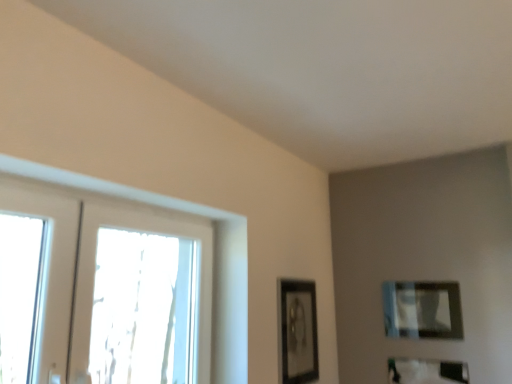
How much space does matte black picture frame at center, acting as the 3th picture frame starting from the right, occupy vertically?

matte black picture frame at center, acting as the 3th picture frame starting from the right, is 20.50 inches in height.

This screenshot has width=512, height=384. Describe the element at coordinates (103, 289) in the screenshot. I see `clear glass window at left` at that location.

Locate an element on the screen. The height and width of the screenshot is (384, 512). matte black picture frame at center, marked as the first picture frame in a left-to-right arrangement is located at coordinates (298, 331).

Does matte black picture frame at lower right, marked as the 1th picture frame in a right-to-left arrangement, touch matte black picture frame at center, acting as the 3th picture frame starting from the right?

No.

Considering the relative sizes of matte black picture frame at lower right, the 3th picture frame viewed from the left, and matte black picture frame at center, marked as the first picture frame in a left-to-right arrangement, in the image provided, is matte black picture frame at lower right, the 3th picture frame viewed from the left, wider than matte black picture frame at center, marked as the first picture frame in a left-to-right arrangement,?

Correct, the width of matte black picture frame at lower right, the 3th picture frame viewed from the left, exceeds that of matte black picture frame at center, marked as the first picture frame in a left-to-right arrangement.

In the scene shown: Could you tell me if matte black picture frame at lower right, the 3th picture frame viewed from the left, is facing matte black picture frame at center, marked as the first picture frame in a left-to-right arrangement?

No.

Between point (304, 326) and point (456, 311), which one is positioned behind?

Point (456, 311)

Is matte black picture frame at center, acting as the 3th picture frame starting from the right, in front of matte black picture frame at upper right, which is counted as the 2th picture frame, starting from the right?

Yes.

Which of these two, matte black picture frame at center, marked as the first picture frame in a left-to-right arrangement, or matte black picture frame at upper right, which is counted as the 2th picture frame, starting from the left, is smaller?

matte black picture frame at upper right, which is counted as the 2th picture frame, starting from the left.

From the matte black picture frame at center, marked as the first picture frame in a left-to-right arrangement, count 1st picture frame to the right and point to it. Please provide its 2D coordinates.

[(422, 309)]

Which is closer to the camera, (129,208) or (407,282)?

Point (129,208)

Is clear glass window at left to the left or to the right of matte black picture frame at upper right, which is counted as the 2th picture frame, starting from the left, in the image?

In the image, clear glass window at left appears on the left side of matte black picture frame at upper right, which is counted as the 2th picture frame, starting from the left.

Can you confirm if clear glass window at left is shorter than matte black picture frame at upper right, which is counted as the 2th picture frame, starting from the left?

No, clear glass window at left is not shorter than matte black picture frame at upper right, which is counted as the 2th picture frame, starting from the left.

Based on the photo, could you tell me if clear glass window at left is turned towards matte black picture frame at upper right, which is counted as the 2th picture frame, starting from the right?

No, clear glass window at left is not facing towards matte black picture frame at upper right, which is counted as the 2th picture frame, starting from the right.

Is matte black picture frame at upper right, which is counted as the 2th picture frame, starting from the right, looking in the opposite direction of matte black picture frame at center, marked as the first picture frame in a left-to-right arrangement?

No, matte black picture frame at upper right, which is counted as the 2th picture frame, starting from the right,'s orientation is not away from matte black picture frame at center, marked as the first picture frame in a left-to-right arrangement.

Is matte black picture frame at upper right, which is counted as the 2th picture frame, starting from the right, outside of matte black picture frame at center, marked as the first picture frame in a left-to-right arrangement?

matte black picture frame at upper right, which is counted as the 2th picture frame, starting from the right, is positioned outside matte black picture frame at center, marked as the first picture frame in a left-to-right arrangement.

From a real-world perspective, is matte black picture frame at upper right, which is counted as the 2th picture frame, starting from the left, positioned under matte black picture frame at center, acting as the 3th picture frame starting from the right, based on gravity?

Incorrect, from a real-world perspective, matte black picture frame at upper right, which is counted as the 2th picture frame, starting from the left, is higher than matte black picture frame at center, acting as the 3th picture frame starting from the right.

Visually, is matte black picture frame at upper right, which is counted as the 2th picture frame, starting from the left, positioned to the left or to the right of matte black picture frame at center, acting as the 3th picture frame starting from the right?

matte black picture frame at upper right, which is counted as the 2th picture frame, starting from the left, is to the right of matte black picture frame at center, acting as the 3th picture frame starting from the right.

Is matte black picture frame at lower right, the 3th picture frame viewed from the left, in contact with clear glass window at left?

No, matte black picture frame at lower right, the 3th picture frame viewed from the left, is not touching clear glass window at left.

Locate an element on the screen. This screenshot has height=384, width=512. window on the left of matte black picture frame at lower right, marked as the 1th picture frame in a right-to-left arrangement is located at coordinates (103, 289).

From a real-world perspective, is matte black picture frame at lower right, marked as the 1th picture frame in a right-to-left arrangement, under clear glass window at left?

Yes, from a real-world perspective, matte black picture frame at lower right, marked as the 1th picture frame in a right-to-left arrangement, is below clear glass window at left.

Does matte black picture frame at lower right, marked as the 1th picture frame in a right-to-left arrangement, have a greater height compared to clear glass window at left?

Incorrect, the height of matte black picture frame at lower right, marked as the 1th picture frame in a right-to-left arrangement, is not larger of that of clear glass window at left.

Can you tell me how much clear glass window at left and matte black picture frame at lower right, marked as the 1th picture frame in a right-to-left arrangement, differ in facing direction?

The angular difference between clear glass window at left and matte black picture frame at lower right, marked as the 1th picture frame in a right-to-left arrangement, is 90.1 degrees.

Locate an element on the screen. This screenshot has width=512, height=384. the 3rd picture frame below the clear glass window at left (from the image's perspective) is located at coordinates (426, 371).

From the image's perspective, is clear glass window at left over matte black picture frame at lower right, the 3th picture frame viewed from the left?

Correct, clear glass window at left appears higher than matte black picture frame at lower right, the 3th picture frame viewed from the left, in the image.

How distant is clear glass window at left from matte black picture frame at lower right, the 3th picture frame viewed from the left?

clear glass window at left is 5.93 feet from matte black picture frame at lower right, the 3th picture frame viewed from the left.

Consider the image. How distant is matte black picture frame at upper right, which is counted as the 2th picture frame, starting from the right, from matte black picture frame at lower right, marked as the 1th picture frame in a right-to-left arrangement?

The distance of matte black picture frame at upper right, which is counted as the 2th picture frame, starting from the right, from matte black picture frame at lower right, marked as the 1th picture frame in a right-to-left arrangement, is 24.36 centimeters.

Considering the relative positions of matte black picture frame at upper right, which is counted as the 2th picture frame, starting from the right, and matte black picture frame at lower right, marked as the 1th picture frame in a right-to-left arrangement, in the image provided, is matte black picture frame at upper right, which is counted as the 2th picture frame, starting from the right, to the left of matte black picture frame at lower right, marked as the 1th picture frame in a right-to-left arrangement, from the viewer's perspective?

Yes, matte black picture frame at upper right, which is counted as the 2th picture frame, starting from the right, is to the left of matte black picture frame at lower right, marked as the 1th picture frame in a right-to-left arrangement.

Between matte black picture frame at upper right, which is counted as the 2th picture frame, starting from the right, and matte black picture frame at lower right, marked as the 1th picture frame in a right-to-left arrangement, which one has smaller size?

Smaller between the two is matte black picture frame at lower right, marked as the 1th picture frame in a right-to-left arrangement.

Which object is more forward, matte black picture frame at upper right, which is counted as the 2th picture frame, starting from the right, or matte black picture frame at lower right, the 3th picture frame viewed from the left?

matte black picture frame at lower right, the 3th picture frame viewed from the left, is in front.

Identify the location of picture frame below the matte black picture frame at center, marked as the first picture frame in a left-to-right arrangement (from the image's perspective). The width and height of the screenshot is (512, 384). (426, 371).

The width and height of the screenshot is (512, 384). Identify the location of picture frame that is on the left side of matte black picture frame at upper right, which is counted as the 2th picture frame, starting from the left. (298, 331).

From the image, which object appears to be farther from clear glass window at left, matte black picture frame at center, acting as the 3th picture frame starting from the right, or matte black picture frame at lower right, the 3th picture frame viewed from the left?

Among the two, matte black picture frame at lower right, the 3th picture frame viewed from the left, is located further to clear glass window at left.

Based on their spatial positions, is matte black picture frame at lower right, the 3th picture frame viewed from the left, or clear glass window at left further from matte black picture frame at upper right, which is counted as the 2th picture frame, starting from the left?

clear glass window at left is positioned further to the anchor matte black picture frame at upper right, which is counted as the 2th picture frame, starting from the left.

Considering their positions, is clear glass window at left positioned further to matte black picture frame at lower right, marked as the 1th picture frame in a right-to-left arrangement, than matte black picture frame at center, acting as the 3th picture frame starting from the right?

clear glass window at left.

Looking at the image, which one is located closer to matte black picture frame at upper right, which is counted as the 2th picture frame, starting from the right, clear glass window at left or matte black picture frame at lower right, the 3th picture frame viewed from the left?

Based on the image, matte black picture frame at lower right, the 3th picture frame viewed from the left, appears to be nearer to matte black picture frame at upper right, which is counted as the 2th picture frame, starting from the right.

Looking at the image, which one is located closer to matte black picture frame at center, acting as the 3th picture frame starting from the right, matte black picture frame at upper right, which is counted as the 2th picture frame, starting from the left, or matte black picture frame at lower right, the 3th picture frame viewed from the left?

Based on the image, matte black picture frame at upper right, which is counted as the 2th picture frame, starting from the left, appears to be nearer to matte black picture frame at center, acting as the 3th picture frame starting from the right.

Looking at the image, which one is located further to clear glass window at left, matte black picture frame at lower right, the 3th picture frame viewed from the left, or matte black picture frame at upper right, which is counted as the 2th picture frame, starting from the left?

Based on the image, matte black picture frame at lower right, the 3th picture frame viewed from the left, appears to be further to clear glass window at left.

Considering their positions, is clear glass window at left positioned further to matte black picture frame at lower right, the 3th picture frame viewed from the left, than matte black picture frame at upper right, which is counted as the 2th picture frame, starting from the right?

clear glass window at left is positioned further to the anchor matte black picture frame at lower right, the 3th picture frame viewed from the left.

Which object lies further to the anchor point matte black picture frame at center, acting as the 3th picture frame starting from the right, matte black picture frame at upper right, which is counted as the 2th picture frame, starting from the right, or clear glass window at left?

clear glass window at left is positioned further to the anchor matte black picture frame at center, acting as the 3th picture frame starting from the right.

I want to click on picture frame between clear glass window at left and matte black picture frame at lower right, the 3th picture frame viewed from the left, in the front-back direction, so click(298, 331).

Where is `picture frame between matte black picture frame at center, acting as the 3th picture frame starting from the right, and matte black picture frame at lower right, the 3th picture frame viewed from the left, in the horizontal direction`? The image size is (512, 384). picture frame between matte black picture frame at center, acting as the 3th picture frame starting from the right, and matte black picture frame at lower right, the 3th picture frame viewed from the left, in the horizontal direction is located at coordinates (422, 309).